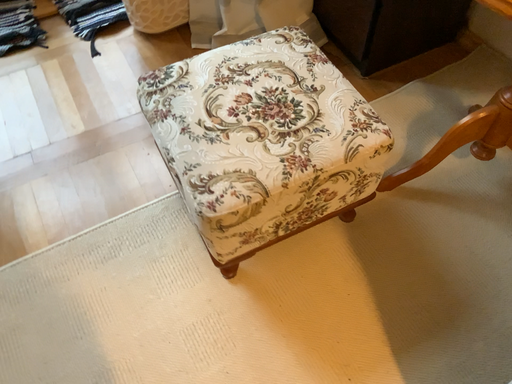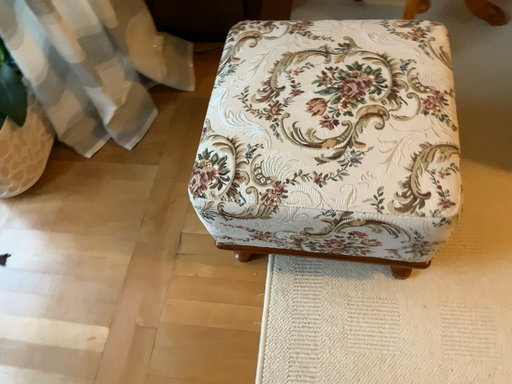
Question: How did the camera likely rotate when shooting the video?

Choices:
 (A) rotated downward
 (B) rotated upward

Answer: (B)